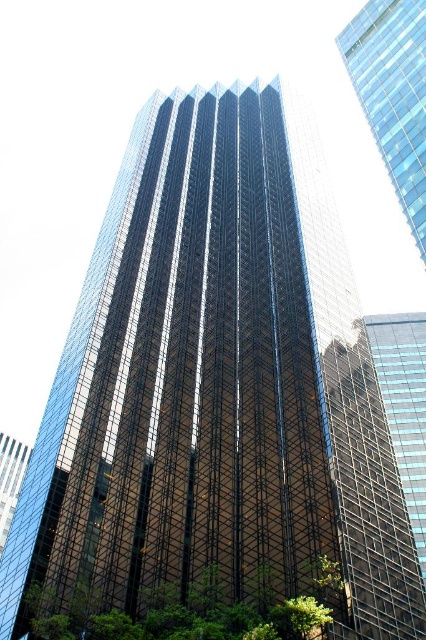
Question: Which point is farther to the camera?

Choices:
 (A) green leafy tree at lower right
 (B) transparent glass skyscraper at upper right
 (C) green leafy tree at lower left

Answer: (B)

Question: Can you confirm if transparent glass skyscraper at upper right is smaller than green leafy tree at lower left?

Choices:
 (A) no
 (B) yes

Answer: (A)

Question: Which point is farther from the camera taking this photo?

Choices:
 (A) (359, 16)
 (B) (305, 600)

Answer: (A)

Question: Is transparent glass skyscraper at upper right below green leafy tree at lower left?

Choices:
 (A) yes
 (B) no

Answer: (B)

Question: Can you confirm if transparent glass skyscraper at upper right is bigger than green leafy tree at lower left?

Choices:
 (A) no
 (B) yes

Answer: (B)

Question: Which of these objects is positioned closest to the transparent glass skyscraper at upper right?

Choices:
 (A) green leafy tree at lower left
 (B) green leafy tree at lower right

Answer: (A)